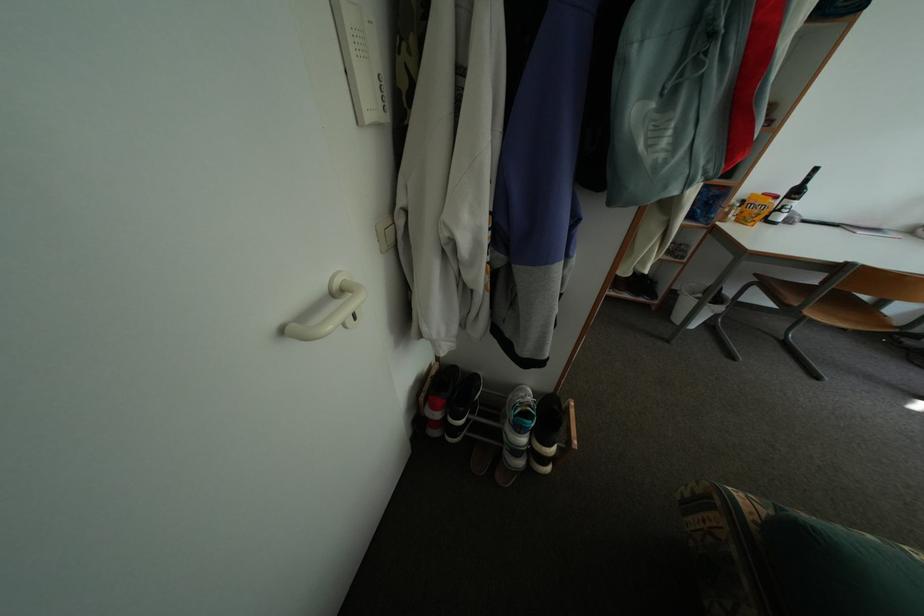
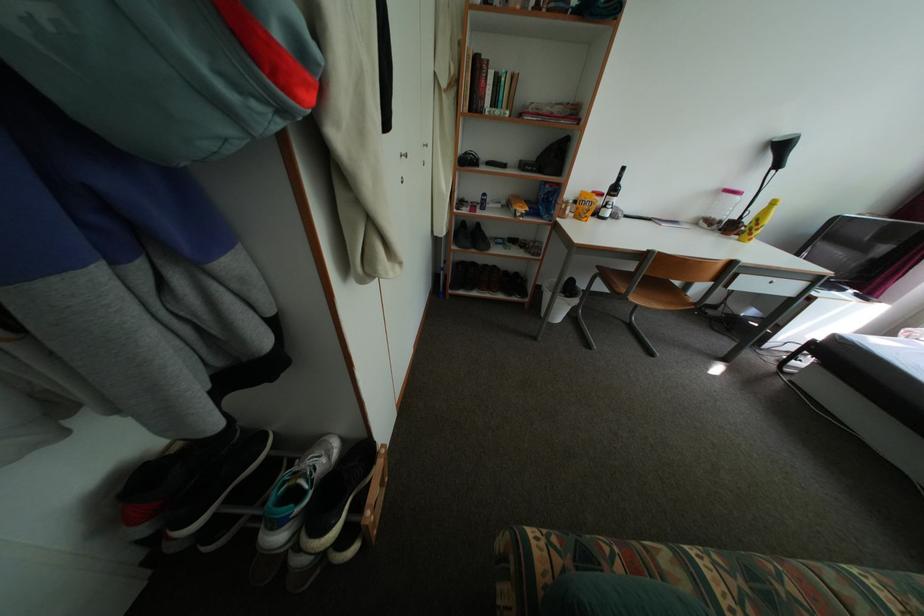
Question: The images are taken continuously from a first-person perspective. In which direction are you moving?

Choices:
 (A) Left
 (B) Right
 (C) Forward
 (D) Backward

Answer: (B)